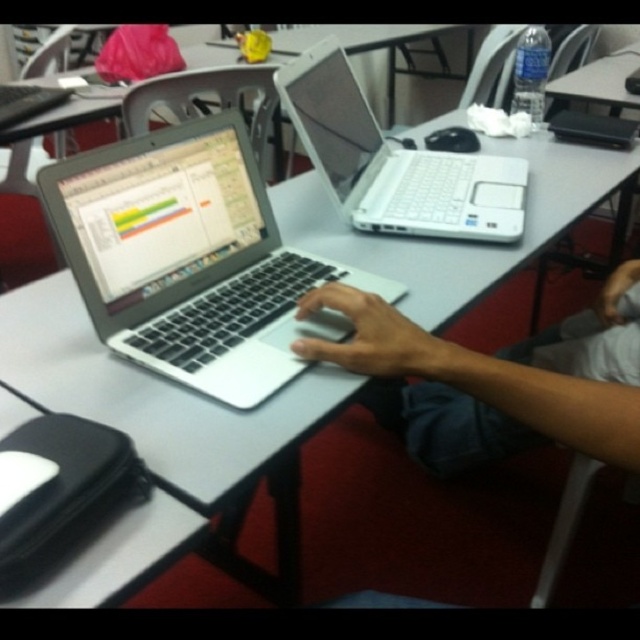
Question: Which of the following is the farthest from the observer?

Choices:
 (A) (429, 132)
 (B) (440, 156)
 (C) (13, 452)
 (D) (240, 244)

Answer: (A)

Question: Can you confirm if silver metallic laptop at center is bigger than black rubberized mouse at lower left?

Choices:
 (A) no
 (B) yes

Answer: (B)

Question: Does silver metallic laptop at center have a lesser width compared to white plastic laptop at upper center?

Choices:
 (A) no
 (B) yes

Answer: (B)

Question: Is silver metallic laptop at center wider than white plastic laptop at upper center?

Choices:
 (A) yes
 (B) no

Answer: (B)

Question: Which of the following is the closest to the observer?

Choices:
 (A) pyautogui.click(x=476, y=138)
 (B) pyautogui.click(x=33, y=488)

Answer: (B)

Question: Considering the real-world distances, which object is closest to the white plastic laptop at upper center?

Choices:
 (A) silver metallic laptop at center
 (B) black matte mouse at center
 (C) black rubberized mouse at lower left

Answer: (B)